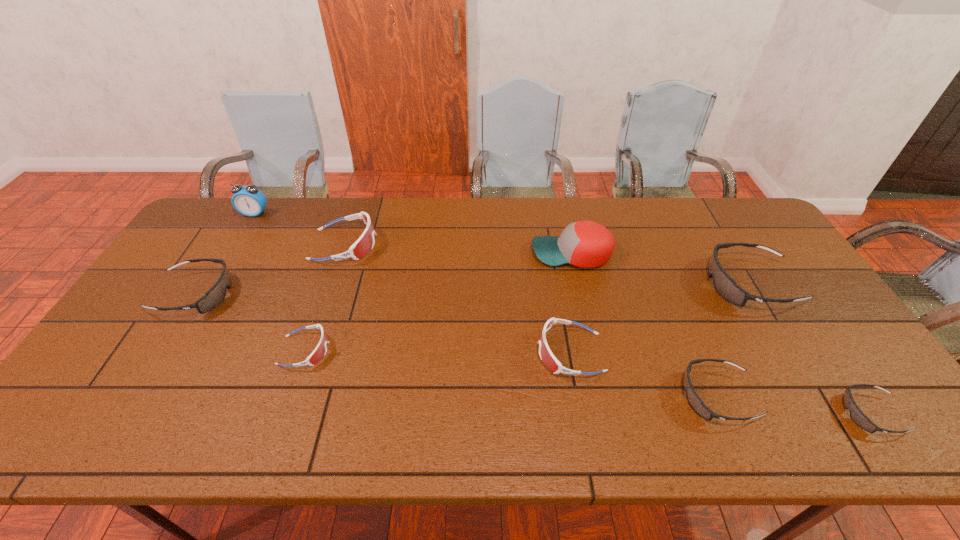
Locate an element on the screen. The width and height of the screenshot is (960, 540). free region located 0.140m on the lenses of the shortest object is located at coordinates (783, 414).

Find the location of a particular element. This screenshot has width=960, height=540. vacant space located 0.050m on the lenses of the shortest object is located at coordinates (822, 414).

This screenshot has height=540, width=960. What are the coordinates of `alarm clock that is at the far edge` in the screenshot? It's located at (248, 200).

The image size is (960, 540). Identify the location of baseball cap that is at the far edge. (586, 244).

Identify the location of goggles that is at the far edge. The image size is (960, 540). (365, 243).

Find the location of a particular element. alarm clock located at the left edge is located at coordinates (248, 200).

Identify the location of goggles that is at the left edge. (213, 297).

Identify the location of object that is at the far left corner. The image size is (960, 540). (248, 200).

The height and width of the screenshot is (540, 960). I want to click on object positioned at the near right corner, so click(x=857, y=416).

Find the location of `vacant space at the far edge`. vacant space at the far edge is located at coordinates (554, 233).